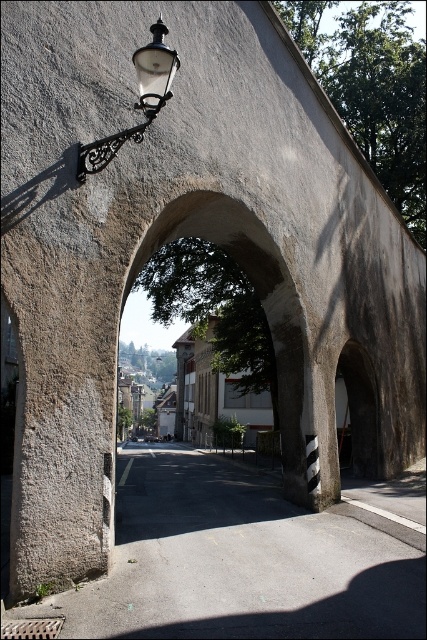
You are an architect designing a new historical district. You need to place a new street light that is the same size as the matte black street light at upper left next to the smooth stone archway at center. Will the new light fit without overlapping the archway?

The smooth stone archway at center is bigger than the matte black street light at upper left. Since the new light will be the same size as the existing one, it should fit without overlapping the archway as long as proper spacing is maintained.

You are a delivery person with a cart that can only move forward. You need to go through the gray concrete alley at center and the smooth stone archway at center. Which one should you go through first?

The gray concrete alley at center is in front of the smooth stone archway at center, so you should go through the gray concrete alley at center first before proceeding to the smooth stone archway at center.